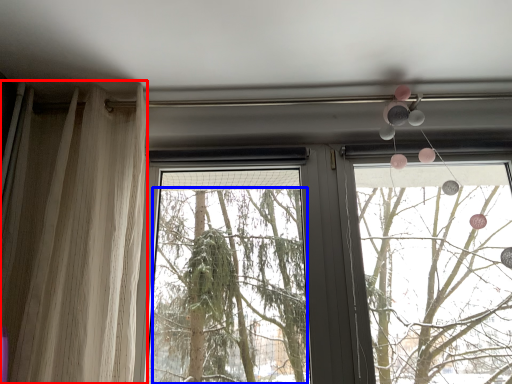
Question: Which point is closer to the camera, curtain (highlighted by a red box) or tree (highlighted by a blue box)?

Choices:
 (A) curtain
 (B) tree

Answer: (A)